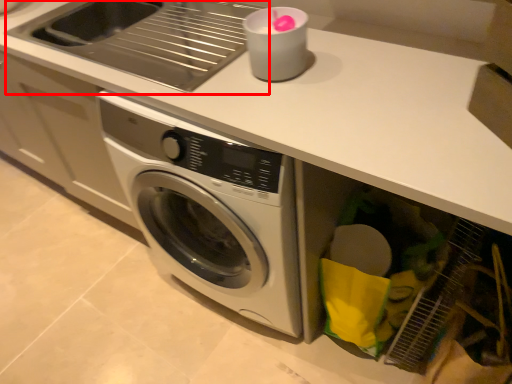
Question: Considering the relative positions of sink (annotated by the red box) and appliance in the image provided, where is sink (annotated by the red box) located with respect to the staircase?

Choices:
 (A) right
 (B) left

Answer: (B)